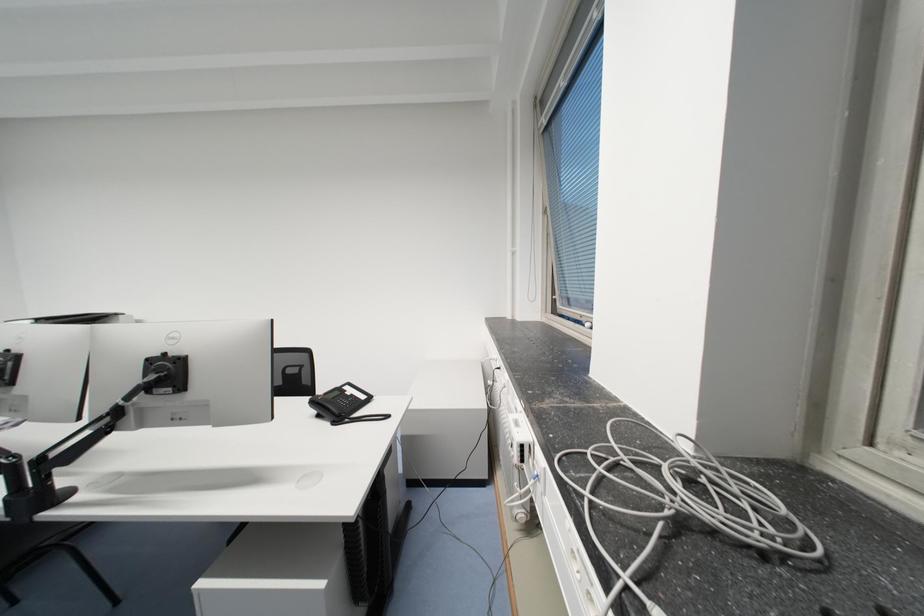
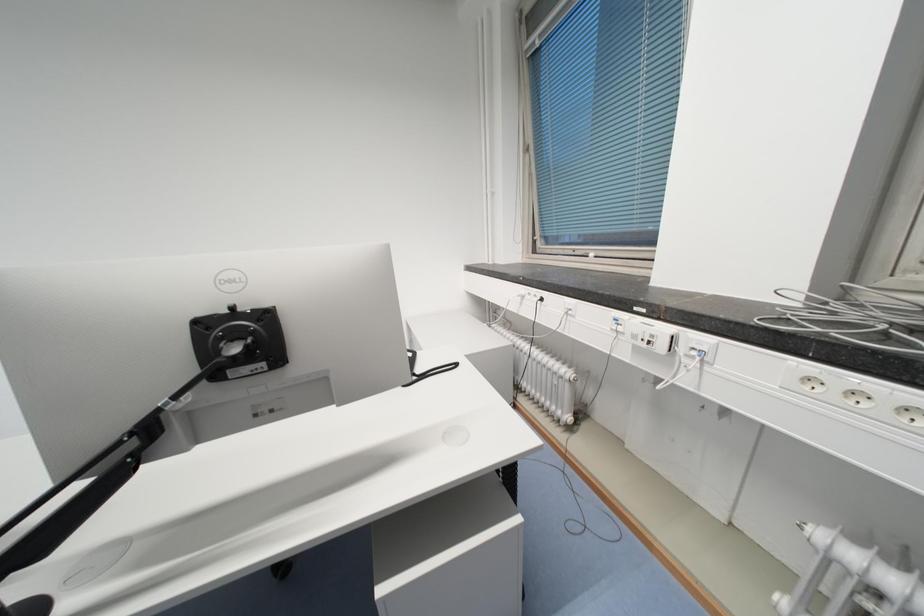
Question: The camera is either moving clockwise (left) or counter-clockwise (right) around the object. The first image is from the beginning of the video and the second image is from the end. Is the camera moving left or right when shooting the video?

Choices:
 (A) Left
 (B) Right

Answer: (A)